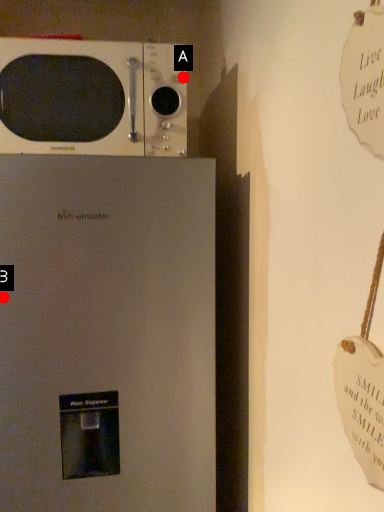
Question: Two points are circled on the image, labeled by A and B beside each circle. Which of the following is the closest to the observer?

Choices:
 (A) A is closer
 (B) B is closer

Answer: (B)